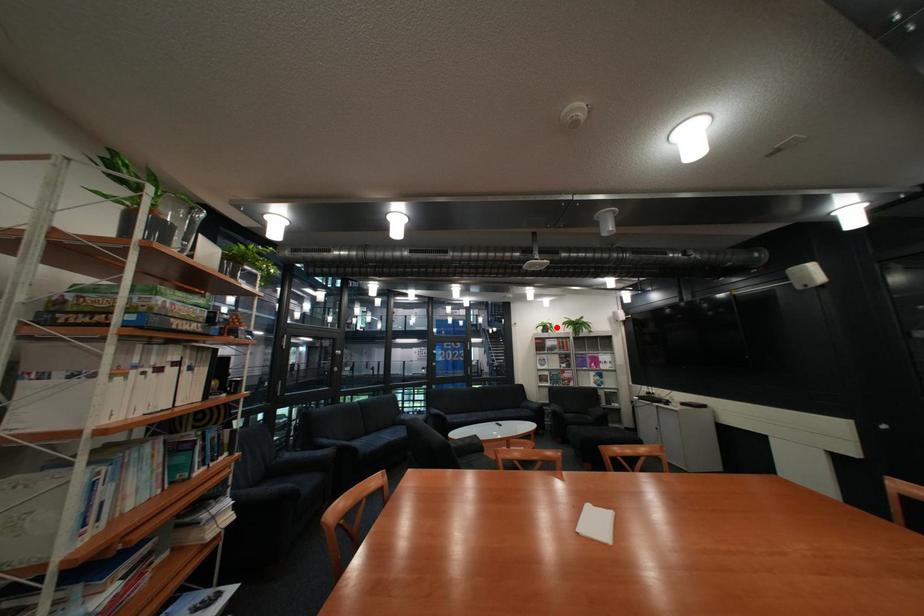
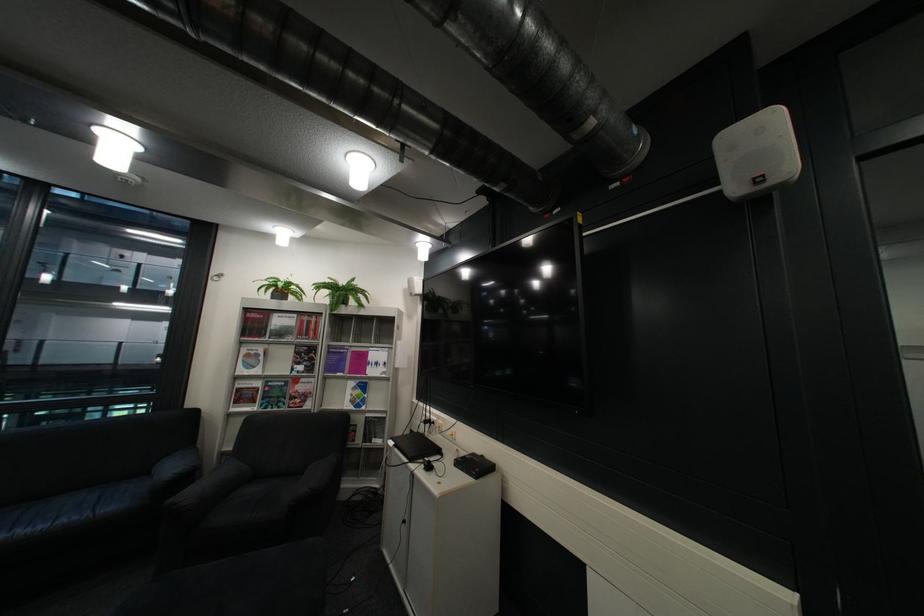
Find the pixel in the second image that matches the highlighted location in the first image.

(287, 290)